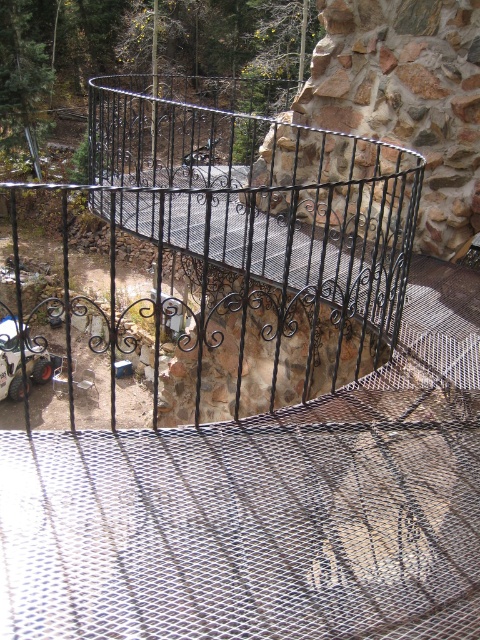
Is black wrought iron cage at center thinner than metallic car at lower left?

Incorrect, black wrought iron cage at center's width is not less than metallic car at lower left's.

Does black wrought iron cage at center lie in front of metallic car at lower left?

Yes.

Between point (337, 161) and point (9, 323), which one is positioned in front?

Point (337, 161)

You are a GUI agent. You are given a task and a screenshot of the screen. Output one action in this format:
    pyautogui.click(x=<x>, y=<y>)
    Task: Click on the black wrought iron cage at center
    
    Given the screenshot: What is the action you would take?
    click(260, 244)